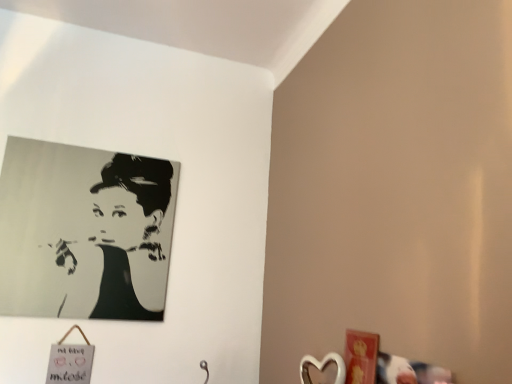
Question: Is black matte portrait at upper left positioned with its back to metallic silver heart at lower right?

Choices:
 (A) no
 (B) yes

Answer: (A)

Question: Is black matte portrait at upper left outside of metallic silver heart at lower right?

Choices:
 (A) no
 (B) yes

Answer: (B)

Question: Considering the relative positions of black matte portrait at upper left and metallic silver heart at lower right in the image provided, is black matte portrait at upper left in front of metallic silver heart at lower right?

Choices:
 (A) yes
 (B) no

Answer: (B)

Question: Would you say metallic silver heart at lower right is part of black matte portrait at upper left's contents?

Choices:
 (A) yes
 (B) no

Answer: (B)

Question: Is black matte portrait at upper left not near metallic silver heart at lower right?

Choices:
 (A) no
 (B) yes

Answer: (B)

Question: Does black matte portrait at upper left have a lesser height compared to metallic silver heart at lower right?

Choices:
 (A) no
 (B) yes

Answer: (A)

Question: Would you say metallic silver heart at lower right is outside black matte portrait at upper left?

Choices:
 (A) yes
 (B) no

Answer: (A)

Question: Is there a large distance between metallic silver heart at lower right and black matte portrait at upper left?

Choices:
 (A) yes
 (B) no

Answer: (A)

Question: Can black matte portrait at upper left be found inside metallic silver heart at lower right?

Choices:
 (A) no
 (B) yes

Answer: (A)

Question: Considering the relative sizes of metallic silver heart at lower right and black matte portrait at upper left in the image provided, is metallic silver heart at lower right shorter than black matte portrait at upper left?

Choices:
 (A) yes
 (B) no

Answer: (A)

Question: Is metallic silver heart at lower right positioned with its back to black matte portrait at upper left?

Choices:
 (A) no
 (B) yes

Answer: (A)

Question: Can you confirm if metallic silver heart at lower right is wider than black matte portrait at upper left?

Choices:
 (A) no
 (B) yes

Answer: (B)

Question: Considering the positions of black matte portrait at upper left and metallic silver heart at lower right in the image, is black matte portrait at upper left bigger or smaller than metallic silver heart at lower right?

Choices:
 (A) big
 (B) small

Answer: (A)